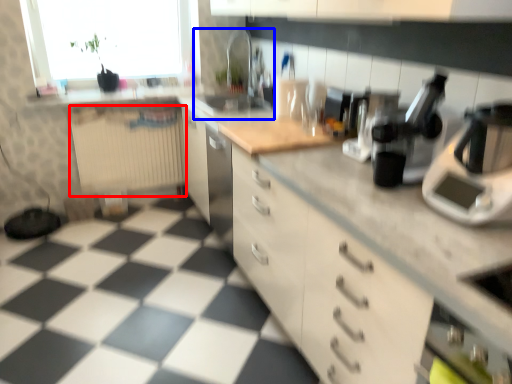
Question: Which of the following is the closest to the observer, radiator (highlighted by a red box) or sink (highlighted by a blue box)?

Choices:
 (A) radiator
 (B) sink

Answer: (B)